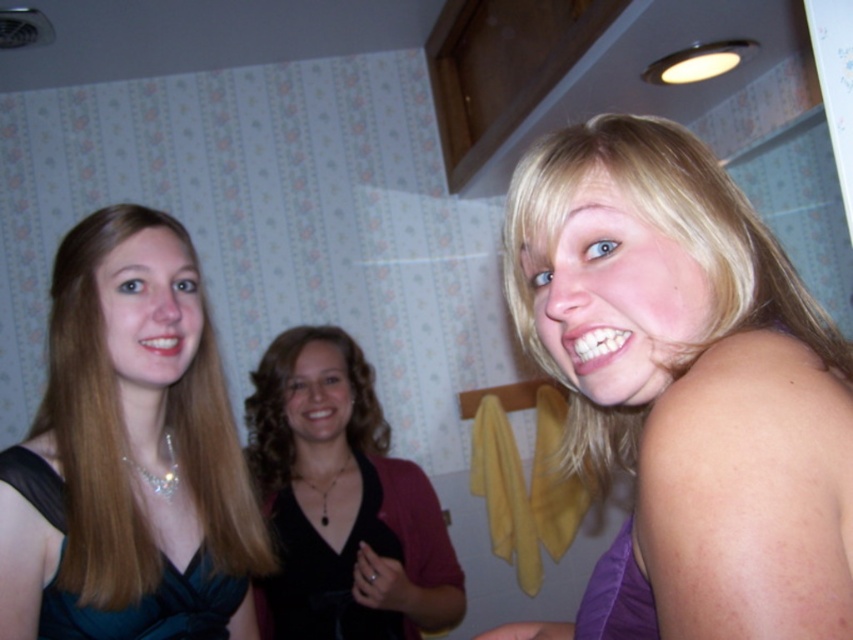
You are a fashion designer who wants to create a new outfit using the black velvet blazer at center and the matte black dress at center. Which item should you choose if you want to create a more voluminous look?

The black velvet blazer at center is larger in size than the matte black dress at center, so choosing the black velvet blazer at center would be better for a more voluminous look.

You are standing in the room and want to move from the point at coordinates point (184, 420) to the point at coordinates point (207, 592). Which direction should you move in to reach your destination?

To move from point (184, 420) to point (207, 592), you should move towards the right and slightly forward since point (207, 592) is in front of point (184, 420).

You are a fashion designer who wants to create a coordinated outfit using the black velvet blazer at center and the satin black dress at left. Which item should you choose as the base piece for the outfit?

The black velvet blazer at center has a larger size compared to the satin black dress at left, so it would be more suitable to use the black velvet blazer at center as the base piece since larger items often serve as foundational pieces in outfits.